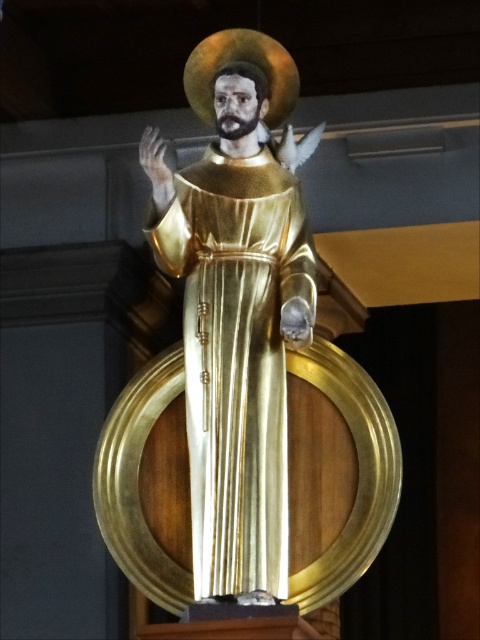
Question: Which of the following is the farthest from the observer?

Choices:
 (A) (363, 433)
 (B) (264, 497)

Answer: (A)

Question: Which of the following is the farthest from the observer?

Choices:
 (A) (216, 576)
 (B) (181, 438)

Answer: (B)

Question: Is gold polished statue at center bigger than gold shiny dress at center?

Choices:
 (A) no
 (B) yes

Answer: (B)

Question: Is gold polished statue at center smaller than gold shiny dress at center?

Choices:
 (A) yes
 (B) no

Answer: (B)

Question: Which of the following is the farthest from the observer?

Choices:
 (A) gold polished statue at center
 (B) gold shiny dress at center

Answer: (B)

Question: Observing the image, what is the correct spatial positioning of gold polished statue at center in reference to gold shiny dress at center?

Choices:
 (A) above
 (B) below

Answer: (B)